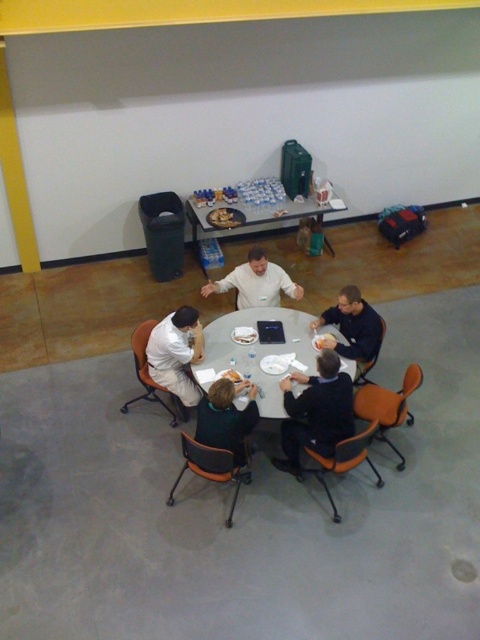
Is dark blue sweater at lower center below metallic silver table at center?

Indeed, dark blue sweater at lower center is positioned under metallic silver table at center.

From the picture: Can you confirm if dark blue sweater at lower center is wider than metallic silver table at center?

No.

What do you see at coordinates (315, 412) in the screenshot? The image size is (480, 640). I see `dark blue sweater at lower center` at bounding box center [315, 412].

Where is `dark blue sweater at lower center`? The image size is (480, 640). dark blue sweater at lower center is located at coordinates tap(315, 412).

Measure the distance between point (154,336) and camera.

4.60 meters

From the picture: How far apart are white matte shirt at lower left and dark green sweater at center?

white matte shirt at lower left is 24.44 inches away from dark green sweater at center.

At what (x,y) coordinates should I click in order to perform the action: click on white matte shirt at lower left. Please return your answer as a coordinate pair (x, y). Looking at the image, I should click on (177, 353).

Does metallic silver table at center have a greater width compared to white matte shirt at lower left?

Yes.

Who is lower down, metallic silver table at center or white matte shirt at lower left?

white matte shirt at lower left

Which is behind, point (335, 193) or point (184, 392)?

The point (335, 193) is behind.

At what (x,y) coordinates should I click in order to perform the action: click on metallic silver table at center. Please return your answer as a coordinate pair (x, y). This screenshot has height=640, width=480. Looking at the image, I should click on (251, 212).